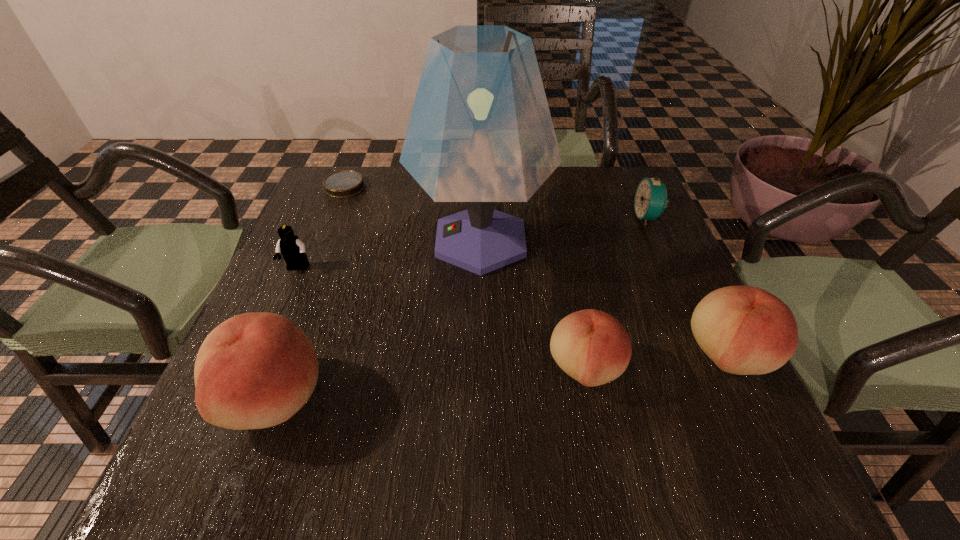
Where is `the leftmost peach`? This screenshot has width=960, height=540. the leftmost peach is located at coordinates (255, 370).

Identify the location of the shortest peach. This screenshot has width=960, height=540. (593, 347).

This screenshot has width=960, height=540. Find the location of `the second tallest peach`. the second tallest peach is located at coordinates (744, 330).

Locate an element on the screen. The image size is (960, 540). the rightmost peach is located at coordinates (744, 330).

What are the coordinates of `the tallest object` in the screenshot? It's located at (480, 132).

Locate an element on the screen. This screenshot has height=540, width=960. compass is located at coordinates (345, 183).

I want to click on the farthest object, so click(345, 183).

Identify the location of alarm clock. This screenshot has width=960, height=540. (650, 200).

You are a GUI agent. You are given a task and a screenshot of the screen. Output one action in this format:
    pyautogui.click(x=<x>, y=<y>)
    Task: Click on the Lego
    This screenshot has width=960, height=540.
    Given the screenshot: What is the action you would take?
    pyautogui.click(x=289, y=245)

Locate an element on the screen. This screenshot has width=960, height=540. vacant region located on the back of the leftmost peach is located at coordinates (339, 225).